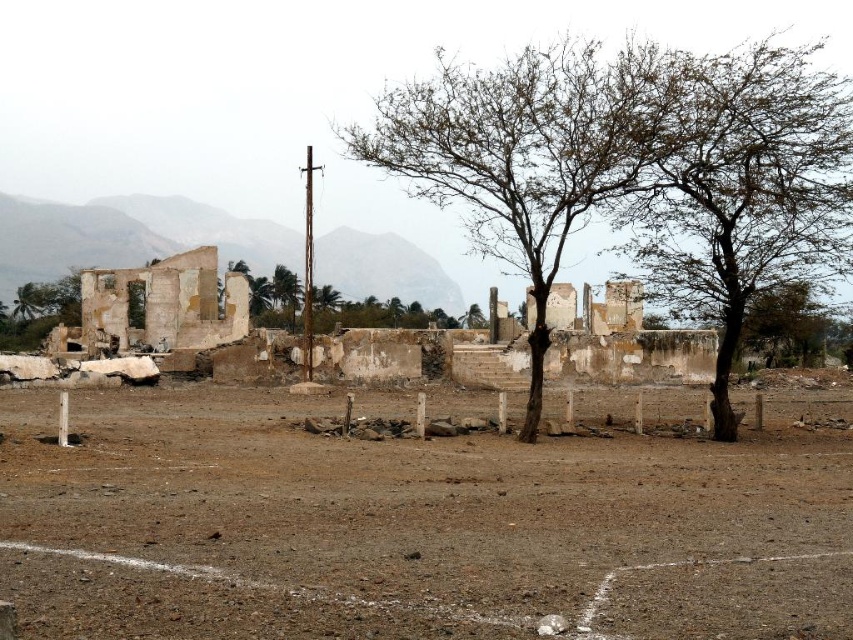
Question: Which point is closer to the camera taking this photo?

Choices:
 (A) (604, 518)
 (B) (741, 65)
 (C) (467, 323)

Answer: (A)

Question: Which object is positioned farthest from the brown dirt field at center?

Choices:
 (A) green leafy tree at center
 (B) brown leafy tree at right

Answer: (A)

Question: Is brown leafy tree at right above green leafy tree at right?

Choices:
 (A) no
 (B) yes

Answer: (B)

Question: Which is farther from the green leafy tree at right?

Choices:
 (A) green leafy tree at center
 (B) weathered concrete ruins at center
 (C) white concrete pillar at center
 (D) brown leafy tree at right

Answer: (A)

Question: Is weathered concrete ruins at center bigger than white concrete pillar at center?

Choices:
 (A) no
 (B) yes

Answer: (B)

Question: Does green leafy tree at right appear over white concrete pillar at center?

Choices:
 (A) yes
 (B) no

Answer: (A)